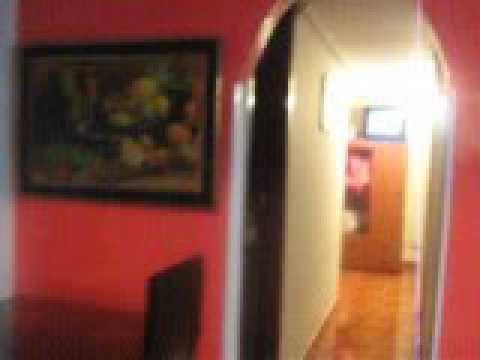
Find the location of a particular element. The image size is (480, 360). possible top of chair or furniture piece is located at coordinates (189, 288), (174, 309), (161, 280).